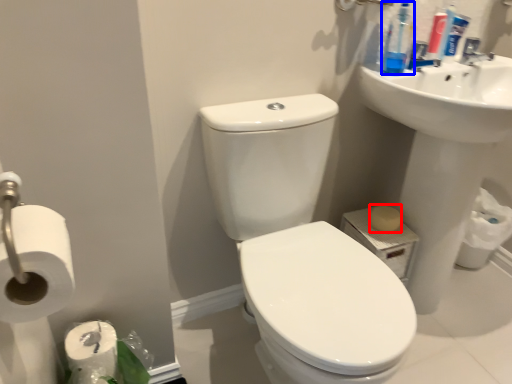
Question: Which of the following is the farthest to the observer, soap (highlighted by a red box) or cleaning product (highlighted by a blue box)?

Choices:
 (A) soap
 (B) cleaning product

Answer: (A)